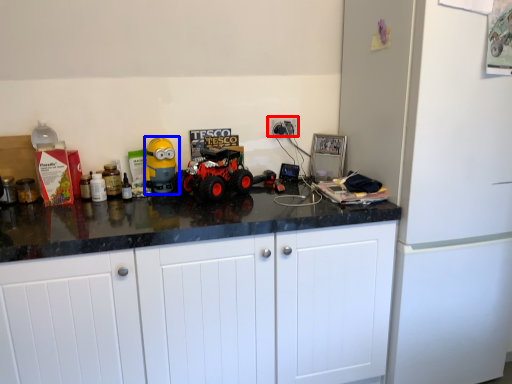
Question: Which point is closer to the camera, electric outlet (highlighted by a red box) or toy (highlighted by a blue box)?

Choices:
 (A) electric outlet
 (B) toy

Answer: (B)